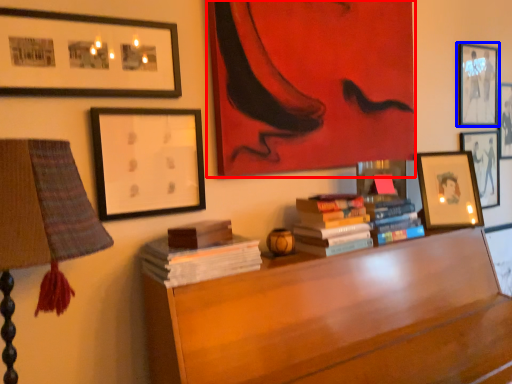
Question: Which object appears farthest to the camera in this image, picture frame (highlighted by a red box) or picture frame (highlighted by a blue box)?

Choices:
 (A) picture frame
 (B) picture frame

Answer: (B)